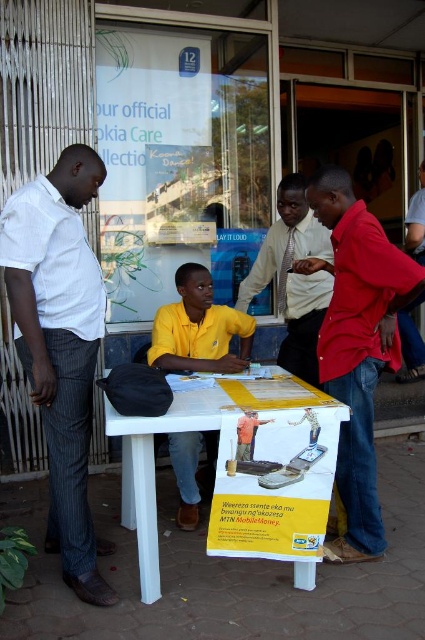
You are a photographer standing behind the table and want to take a photo of the matte red shirt at center and the yellow matte shirt at center. Which shirt will appear closer to the camera in the photo?

The matte red shirt at center will appear closer to the camera because it is positioned in front of the yellow matte shirt at center.

You are a photographer standing in front of the white plastic table at center. You want to take a photo of the matte red shirt at center so that it appears larger in the frame than the table. Is this possible given their sizes?

The matte red shirt at center has a lesser width compared to the white plastic table at center. To make the shirt appear larger in the photo, you can move closer to the shirt while keeping the table farther away, as proximity affects perceived size in photographs.